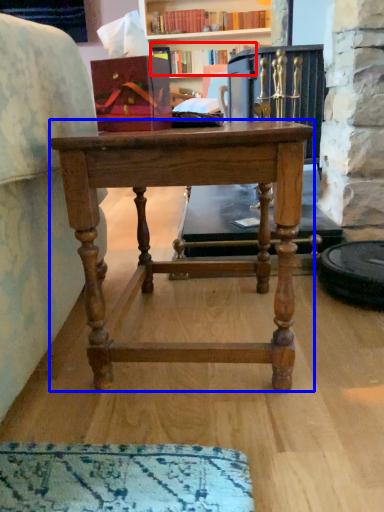
Question: Which object is closer to the camera taking this photo, book (highlighted by a red box) or desk (highlighted by a blue box)?

Choices:
 (A) book
 (B) desk

Answer: (B)